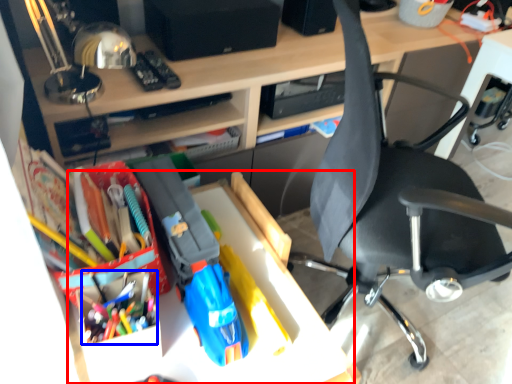
Question: Which object appears farthest to the camera in this image, table (highlighted by a red box) or stationery (highlighted by a blue box)?

Choices:
 (A) table
 (B) stationery

Answer: (B)